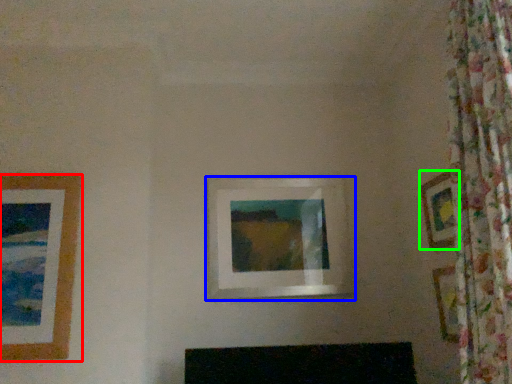
Question: Estimate the real-world distances between objects in this image. Which object is closer to picture frame (highlighted by a red box), picture frame (highlighted by a blue box) or picture frame (highlighted by a green box)?

Choices:
 (A) picture frame
 (B) picture frame

Answer: (A)